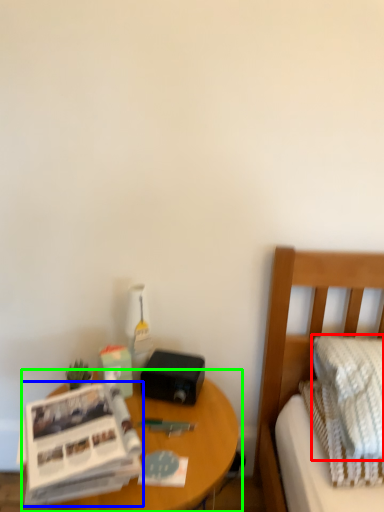
Question: Which is nearer to the pillow (highlighted by a red box)? paperback book (highlighted by a blue box) or nightstand (highlighted by a green box).

Choices:
 (A) paperback book
 (B) nightstand

Answer: (B)